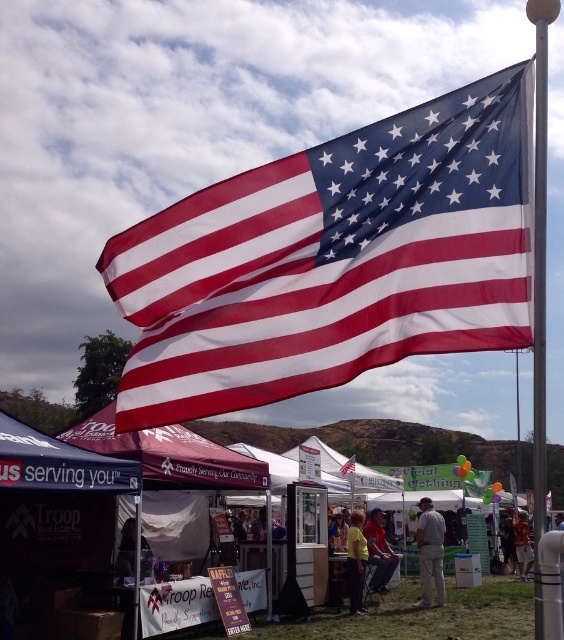
You are at the fairground and see the gray fabric at center and the dark brown leather jacket at center. Which object is closer to you?

The gray fabric at center is closer to you because it is in front of the dark brown leather jacket at center.

You are at an outdoor event and see the polyester american flag at upper center and the gray fabric at center. Which object is positioned higher in the scene?

The polyester american flag at upper center is positioned higher than the gray fabric at center.